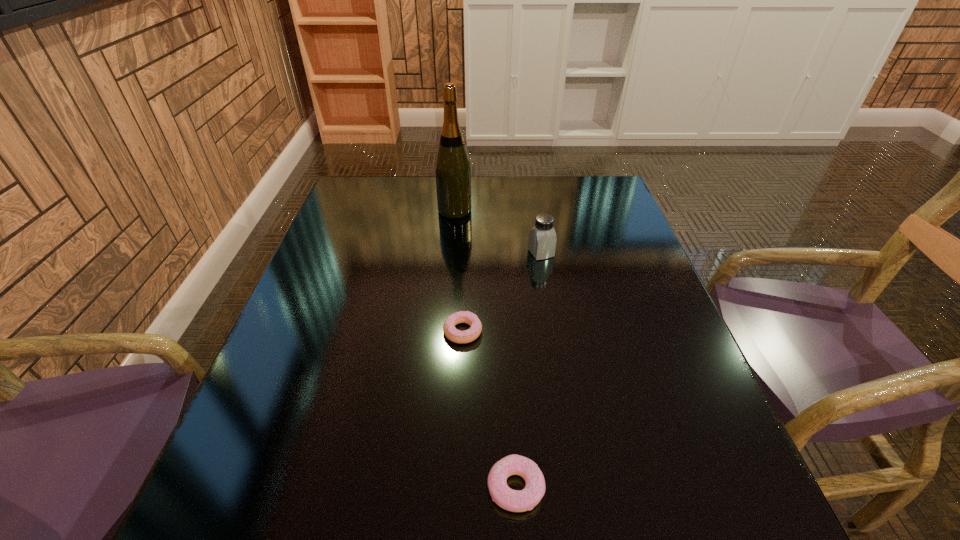
Locate an element on the screen. This screenshot has height=540, width=960. vacant point located between the third nearest object and the wine bottle is located at coordinates (498, 232).

Find the location of a particular element. The image size is (960, 540). vacant region between the tallest object and the saltshaker is located at coordinates (498, 232).

What are the coordinates of `free space between the left doughnut and the third nearest object` in the screenshot? It's located at (502, 292).

This screenshot has width=960, height=540. Identify the location of free space between the farther doughnut and the second tallest object. (502, 292).

Where is `vacant point located between the tallest object and the nearest object`? This screenshot has height=540, width=960. vacant point located between the tallest object and the nearest object is located at coordinates (485, 349).

Locate an element on the screen. Image resolution: width=960 pixels, height=540 pixels. empty location between the second farthest object and the farthest object is located at coordinates (498, 232).

Where is `vacant area that lies between the rightmost object and the tallest object`? vacant area that lies between the rightmost object and the tallest object is located at coordinates (498, 232).

Identify the location of free space between the wine bottle and the saltshaker. (498, 232).

I want to click on free spot between the nearest object and the rightmost object, so click(528, 370).

Identify which object is located as the third nearest to the second object from right to left. Please provide its 2D coordinates. Your answer should be formatted as a tuple, i.e. [(x, y)], where the tuple contains the x and y coordinates of a point satisfying the conditions above.

[(452, 167)]